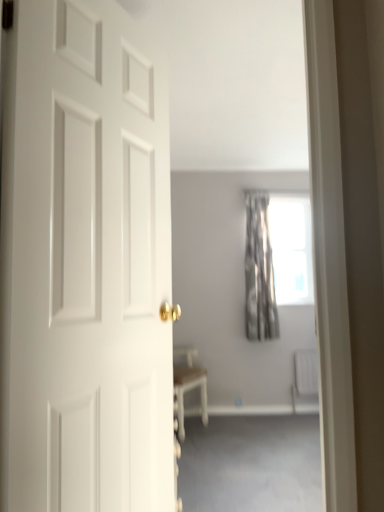
Question: Relative to white plastic radiator at lower right, is silvery metallic curtain at center in front or behind?

Choices:
 (A) front
 (B) behind

Answer: (A)

Question: In terms of width, does silvery metallic curtain at center look wider or thinner when compared to white plastic radiator at lower right?

Choices:
 (A) thin
 (B) wide

Answer: (B)

Question: Based on their relative distances, which object is farther from the gray fabric curtain at upper center?

Choices:
 (A) white matte door at left
 (B) white plastic radiator at lower right
 (C) silvery metallic curtain at center

Answer: (A)

Question: Based on their relative distances, which object is nearer to the white matte door at left?

Choices:
 (A) silvery metallic curtain at center
 (B) white plastic radiator at lower right
 (C) gray fabric curtain at upper center

Answer: (C)